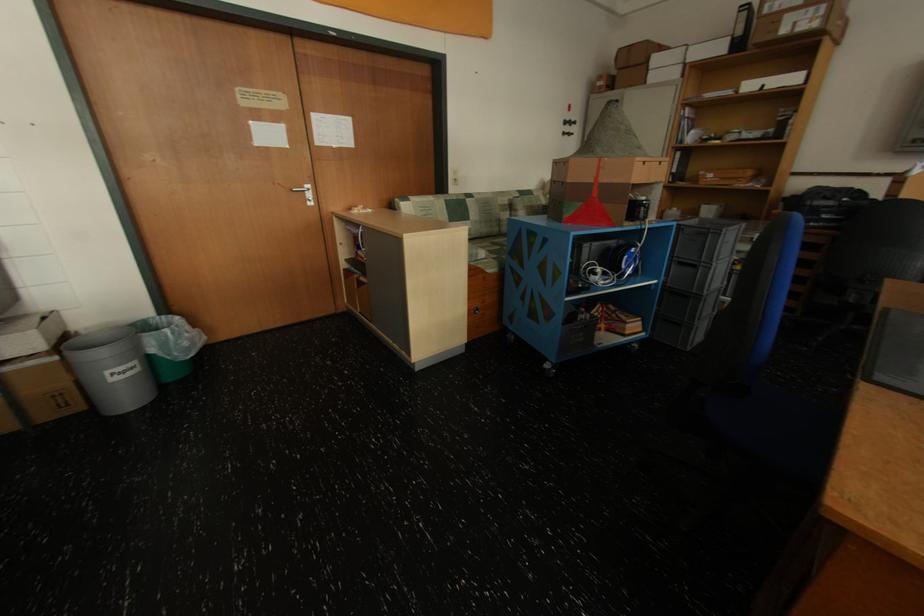
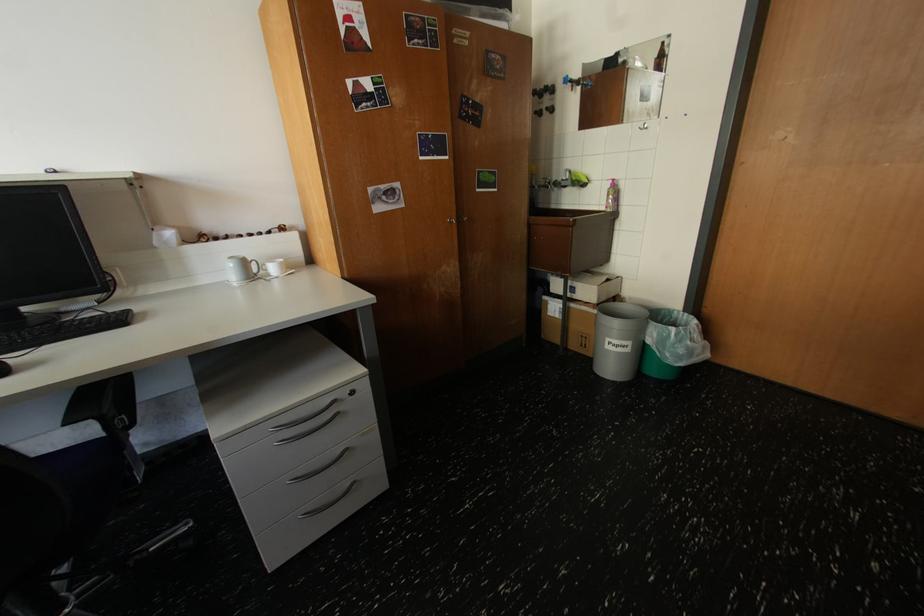
Based on the continuous images, in which direction is the camera rotating?

The camera rotated toward left-down.